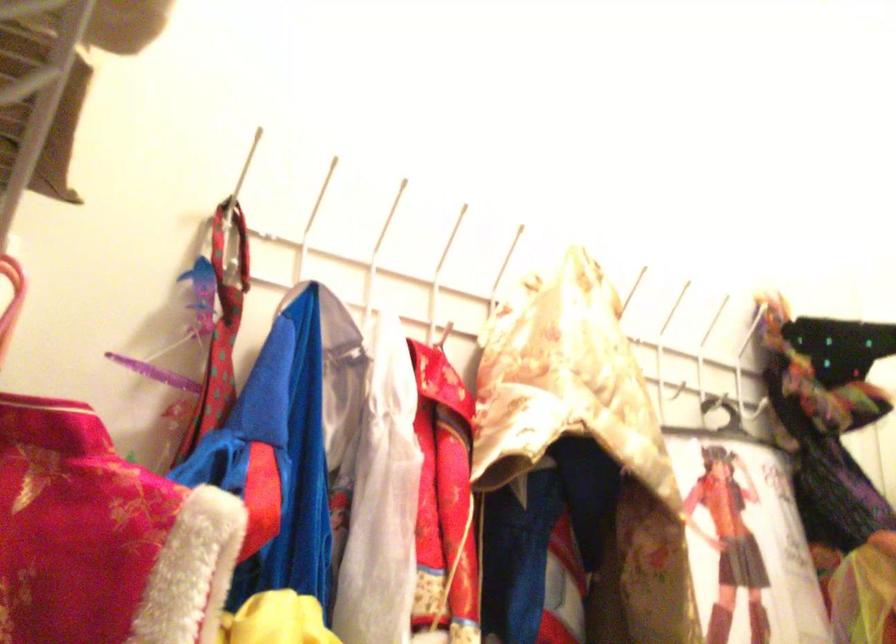
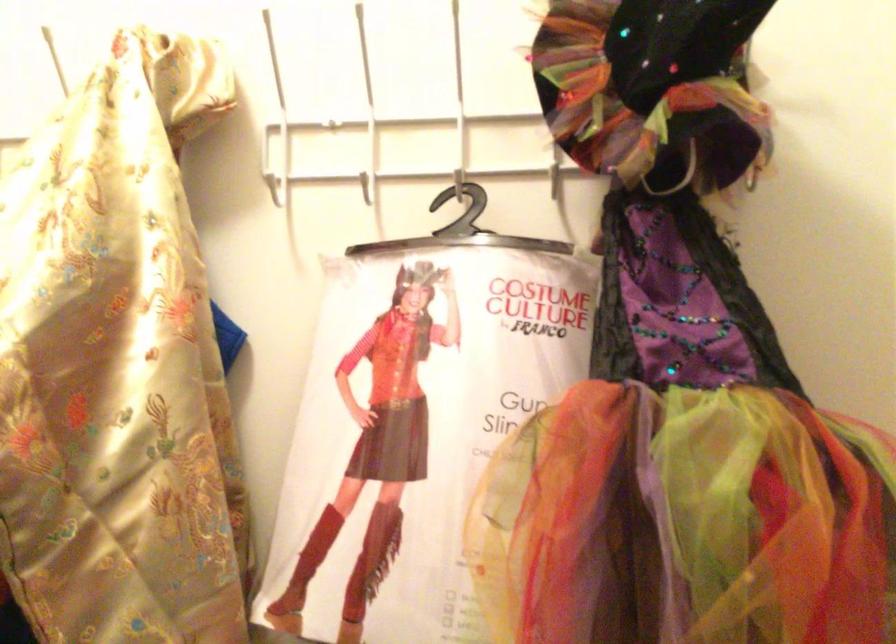
Question: I am providing you with two images of the same scene from different viewpoints. After the viewpoint changes to image2, which objects are now occluded?

Choices:
 (A) black witch hat
 (B) black hanger hook
 (C) white rack hook
 (D) none of these

Answer: (D)